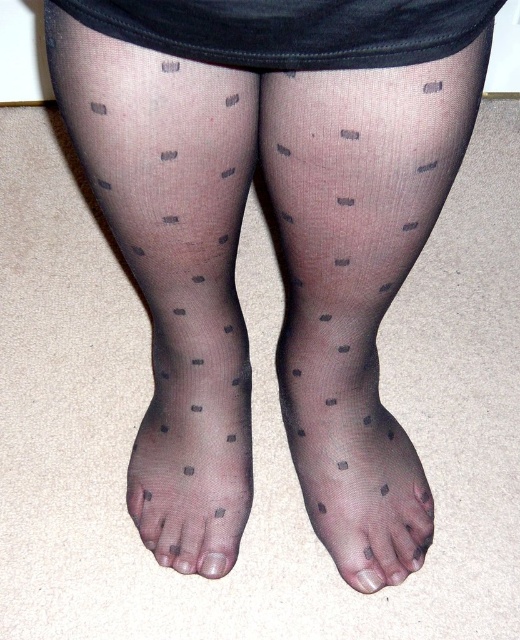
Question: Can you confirm if transparent sheer tights at center is wider than transparent nylon toe at center?

Choices:
 (A) no
 (B) yes

Answer: (B)

Question: Which object is the closest to the transparent sheer tights at center?

Choices:
 (A) transparent nylon toe at center
 (B) transparent sheer tights at lower left
 (C) transparent sheer tights at lower center

Answer: (C)

Question: Can you confirm if transparent sheer tights at lower center is positioned below transparent nylon toe at lower center?

Choices:
 (A) yes
 (B) no

Answer: (B)

Question: Which object is positioned closest to the transparent nylon toe at lower center?

Choices:
 (A) transparent sheer tights at center
 (B) transparent sheer tights at lower left

Answer: (B)

Question: Does transparent sheer tights at lower left appear under transparent nylon toe at lower center?

Choices:
 (A) yes
 (B) no

Answer: (B)

Question: Among these objects, which one is nearest to the camera?

Choices:
 (A) transparent nylon toe at center
 (B) transparent sheer tights at lower left
 (C) transparent nylon toe at lower center
 (D) transparent sheer tights at center

Answer: (D)